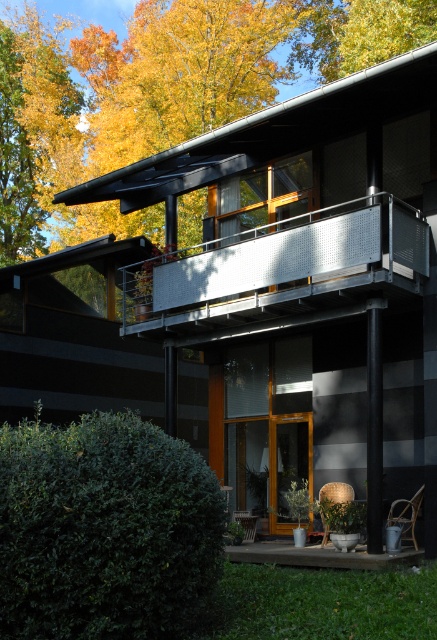
Does metallic silver balcony at upper center appear over concrete deck at lower center?

Yes, metallic silver balcony at upper center is above concrete deck at lower center.

Which is in front, point (271, 291) or point (253, 561)?

Point (253, 561) is in front.

Between point (427, 275) and point (249, 554), which one is positioned behind?

Point (427, 275)

This screenshot has width=437, height=640. I want to click on metallic silver balcony at upper center, so click(278, 272).